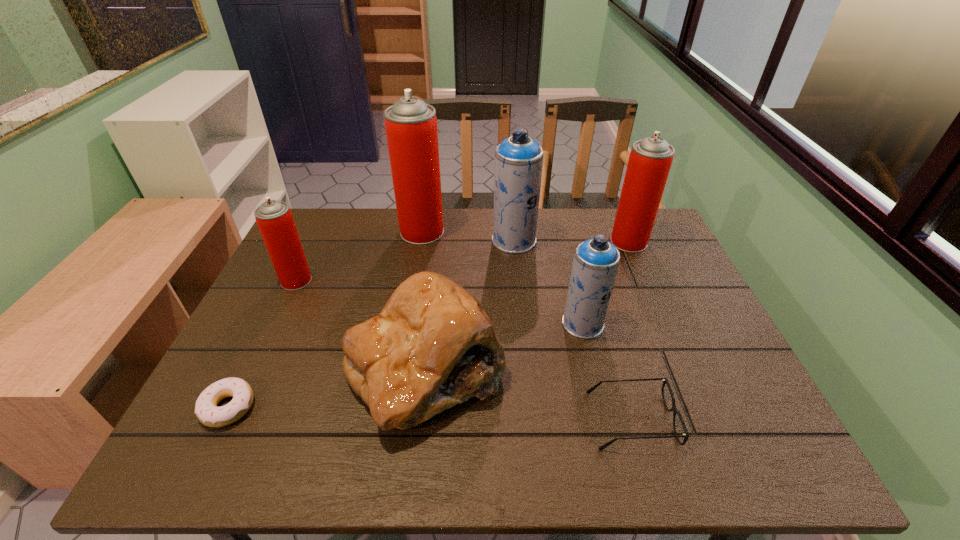
Identify the location of the second red aerosol can from right to left. This screenshot has height=540, width=960. (411, 125).

This screenshot has width=960, height=540. I want to click on the fourth aerosol can from right to left, so click(411, 125).

Locate an element on the screen. The image size is (960, 540). the rightmost red aerosol can is located at coordinates (650, 160).

Locate an element on the screen. This screenshot has width=960, height=540. the second smallest red aerosol can is located at coordinates (650, 160).

This screenshot has height=540, width=960. Find the location of `the left blue aerosol can`. the left blue aerosol can is located at coordinates (518, 166).

Locate an element on the screen. Image resolution: width=960 pixels, height=540 pixels. the third aerosol can from left to right is located at coordinates pos(518,166).

Find the location of a particular element. The width and height of the screenshot is (960, 540). the leftmost aerosol can is located at coordinates (274, 218).

Identify the location of the leftmost red aerosol can. The width and height of the screenshot is (960, 540). (274, 218).

Locate an element on the screen. Image resolution: width=960 pixels, height=540 pixels. the nearest aerosol can is located at coordinates (595, 264).

You are a GUI agent. You are given a task and a screenshot of the screen. Output one action in this format:
    pyautogui.click(x=<x>, y=<y>)
    Task: Click on the right blue aerosol can
    
    Given the screenshot: What is the action you would take?
    pyautogui.click(x=595, y=264)